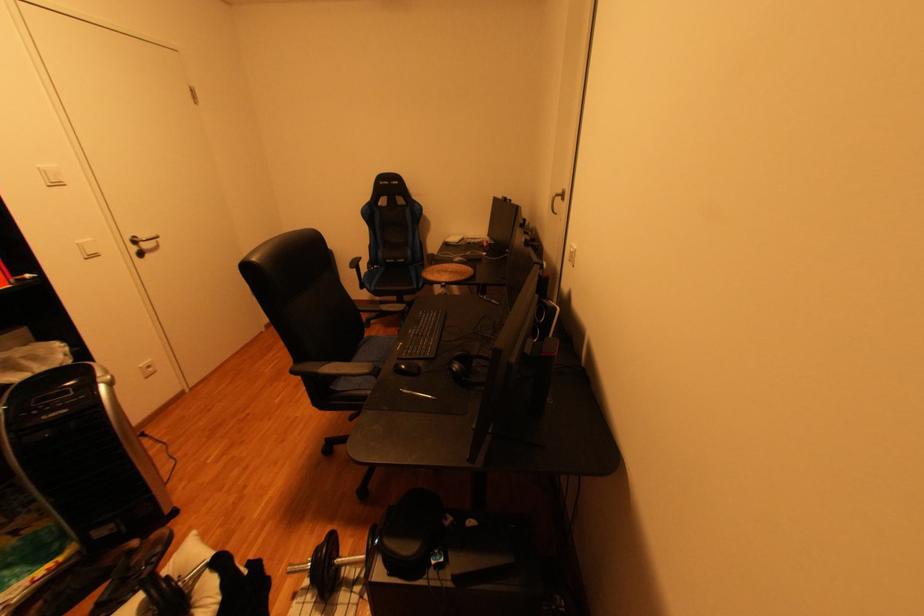
This screenshot has width=924, height=616. Identify the location of black chair armrest. (335, 369).